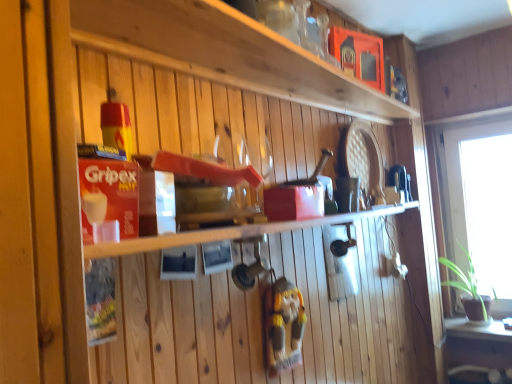
Locate an element on the screen. The width and height of the screenshot is (512, 384). wooden gnome at center is located at coordinates (283, 324).

What do you see at coordinates (480, 203) in the screenshot? I see `transparent glass window at right` at bounding box center [480, 203].

Measure the distance between wooden shelf at center, which appears as the first shelf when ordered from the bottom, and camera.

A distance of 20.55 inches exists between wooden shelf at center, which appears as the first shelf when ordered from the bottom, and camera.

Where is `wooden shelf at center, which appears as the first shelf when ordered from the bottom`? wooden shelf at center, which appears as the first shelf when ordered from the bottom is located at coordinates (229, 233).

Identify the location of wooden gnome at center. This screenshot has height=384, width=512. (283, 324).

Which of these two, green matte table at lower right or wooden gnome at center, is thinner?

Thinner between the two is wooden gnome at center.

From the image's perspective, would you say green matte table at lower right is shown under wooden gnome at center?

Indeed, from the image's perspective, green matte table at lower right is shown beneath wooden gnome at center.

Is green matte table at lower right far from wooden gnome at center?

Yes.

Is green matte table at lower right in front of wooden gnome at center?

No, green matte table at lower right is further to the viewer.

Between point (465, 152) and point (102, 256), which one is positioned in front?

The point (102, 256) is in front.

Is transparent glass window at right located outside wooden shelf at center, the second shelf from the top?

transparent glass window at right is positioned outside wooden shelf at center, the second shelf from the top.

This screenshot has width=512, height=384. Find the location of `shelf that is the 1st one above the transparent glass window at right (from a real-world perspective)`. shelf that is the 1st one above the transparent glass window at right (from a real-world perspective) is located at coordinates (229, 233).

Between point (311, 243) and point (298, 358), which one is positioned in front?

Point (298, 358)

From the image's perspective, does wooden shelf at center, which appears as the first shelf when ordered from the bottom, appear higher than wooden gnome at center?

Indeed, from the image's perspective, wooden shelf at center, which appears as the first shelf when ordered from the bottom, is shown above wooden gnome at center.

Is wooden shelf at center, the second shelf from the top, positioned far away from wooden gnome at center?

No.

At what (x,y) coordinates should I click in order to perform the action: click on table behind the matte wooden shelf at upper center, acting as the 1th shelf starting from the top. Please return your answer as a coordinate pair (x, y). This screenshot has width=512, height=384. Looking at the image, I should click on (478, 347).

Is matte wooden shelf at upper center, acting as the 1th shelf starting from the top, to the right of green matte table at lower right from the viewer's perspective?

No.

Are matte wooden shelf at upper center, which is the second shelf in bottom-to-top order, and green matte table at lower right located far from each other?

Yes, matte wooden shelf at upper center, which is the second shelf in bottom-to-top order, and green matte table at lower right are quite far apart.

From a real-world perspective, which is physically above, matte wooden shelf at upper center, which is the second shelf in bottom-to-top order, or green matte table at lower right?

matte wooden shelf at upper center, which is the second shelf in bottom-to-top order, from a real-world perspective.

Which of these two, transparent glass window at right or green matte table at lower right, stands taller?

transparent glass window at right is taller.

Does transparent glass window at right have a larger size compared to green matte table at lower right?

No, transparent glass window at right is not bigger than green matte table at lower right.

Is the depth of transparent glass window at right greater than that of green matte table at lower right?

Yes.

Consider the image. Can you confirm if transparent glass window at right is wider than green matte table at lower right?

No, transparent glass window at right is not wider than green matte table at lower right.

Does transparent glass window at right have a smaller size compared to matte wooden shelf at upper center, acting as the 1th shelf starting from the top?

Incorrect, transparent glass window at right is not smaller in size than matte wooden shelf at upper center, acting as the 1th shelf starting from the top.

From the image's perspective, would you say transparent glass window at right is shown under matte wooden shelf at upper center, acting as the 1th shelf starting from the top?

Correct, transparent glass window at right appears lower than matte wooden shelf at upper center, acting as the 1th shelf starting from the top, in the image.

Is transparent glass window at right oriented towards matte wooden shelf at upper center, acting as the 1th shelf starting from the top?

Yes, transparent glass window at right is turned towards matte wooden shelf at upper center, acting as the 1th shelf starting from the top.

Is point (490, 226) less distant than point (168, 59)?

No, it is not.

Between point (368, 103) and point (502, 257), which one is positioned in front?

Positioned in front is point (368, 103).

From a real-world perspective, between matte wooden shelf at upper center, which is the second shelf in bottom-to-top order, and transparent glass window at right, who is vertically lower?

transparent glass window at right.

This screenshot has width=512, height=384. Find the location of `toy lying in front of the green matte table at lower right`. toy lying in front of the green matte table at lower right is located at coordinates (283, 324).

Identify the location of window that is below the wooden shelf at center, the second shelf from the top (from the image's perspective). (480, 203).

From the image, which object appears to be nearer to green matte table at lower right, wooden gnome at center or matte wooden shelf at upper center, which is the second shelf in bottom-to-top order?

Among the two, wooden gnome at center is located nearer to green matte table at lower right.

Considering their positions, is green matte table at lower right positioned further to wooden shelf at center, which appears as the first shelf when ordered from the bottom, than transparent glass window at right?

Based on the image, green matte table at lower right appears to be further to wooden shelf at center, which appears as the first shelf when ordered from the bottom.

When comparing their distances from matte wooden shelf at upper center, acting as the 1th shelf starting from the top, does transparent glass window at right or green matte table at lower right seem further?

green matte table at lower right is further to matte wooden shelf at upper center, acting as the 1th shelf starting from the top.

Based on their spatial positions, is green matte table at lower right or wooden gnome at center further from transparent glass window at right?

wooden gnome at center is positioned further to the anchor transparent glass window at right.

Considering their positions, is wooden shelf at center, which appears as the first shelf when ordered from the bottom, positioned further to transparent glass window at right than wooden gnome at center?

The object further to transparent glass window at right is wooden gnome at center.

Looking at the image, which one is located further to wooden gnome at center, wooden shelf at center, which appears as the first shelf when ordered from the bottom, or transparent glass window at right?

Among the two, transparent glass window at right is located further to wooden gnome at center.

Which object lies nearer to the anchor point transparent glass window at right, wooden shelf at center, which appears as the first shelf when ordered from the bottom, or green matte table at lower right?

green matte table at lower right is positioned closer to the anchor transparent glass window at right.

Which object lies nearer to the anchor point transparent glass window at right, wooden gnome at center or matte wooden shelf at upper center, acting as the 1th shelf starting from the top?

matte wooden shelf at upper center, acting as the 1th shelf starting from the top, lies closer to transparent glass window at right than the other object.

Where is `toy between matte wooden shelf at upper center, which is the second shelf in bottom-to-top order, and transparent glass window at right in the front-back direction`? This screenshot has height=384, width=512. toy between matte wooden shelf at upper center, which is the second shelf in bottom-to-top order, and transparent glass window at right in the front-back direction is located at coordinates (283, 324).

Find the location of a particular element. Image resolution: width=512 pixels, height=384 pixels. shelf positioned between wooden shelf at center, which appears as the first shelf when ordered from the bottom, and green matte table at lower right from near to far is located at coordinates (226, 52).

Locate an element on the screen. This screenshot has width=512, height=384. shelf between wooden shelf at center, the second shelf from the top, and transparent glass window at right in the front-back direction is located at coordinates click(226, 52).

Find the location of a particular element. table located between wooden shelf at center, the second shelf from the top, and transparent glass window at right in the depth direction is located at coordinates (478, 347).